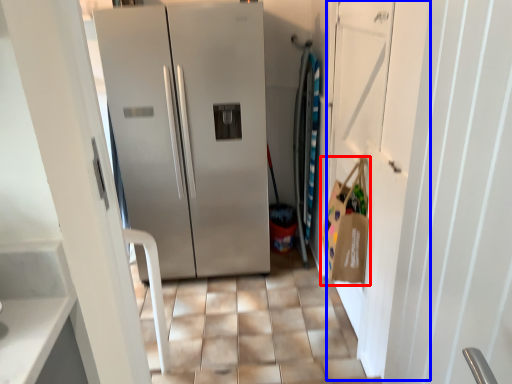
Question: Which object is closer to the camera taking this photo, shopping bag (highlighted by a red box) or door (highlighted by a blue box)?

Choices:
 (A) shopping bag
 (B) door

Answer: (B)